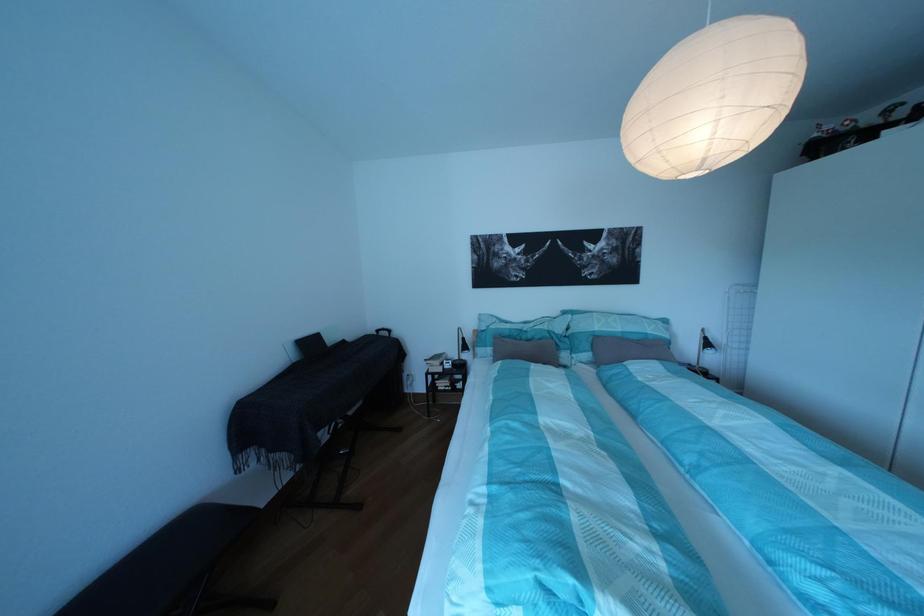
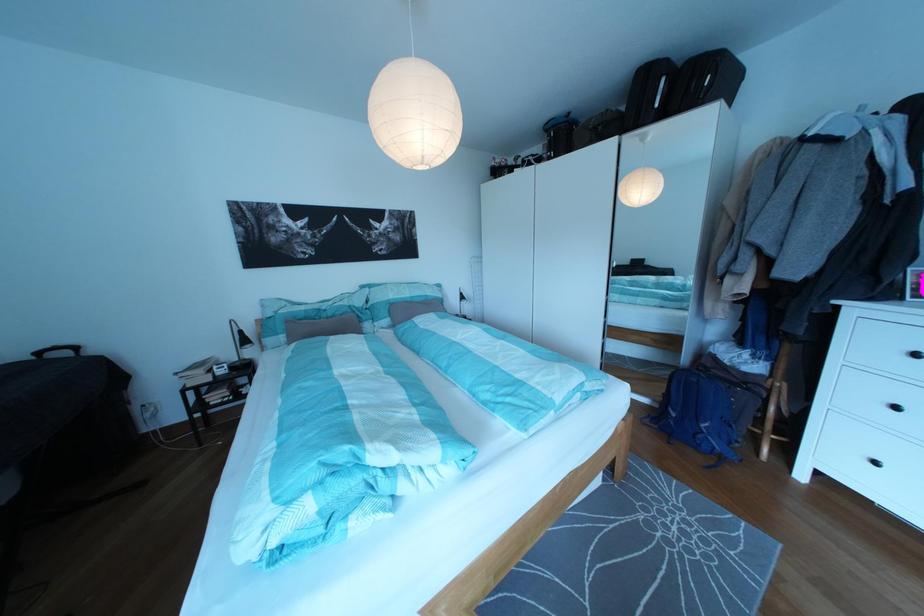
Find the pixel in the second image that matches (x=391, y=337) in the first image.

(53, 360)